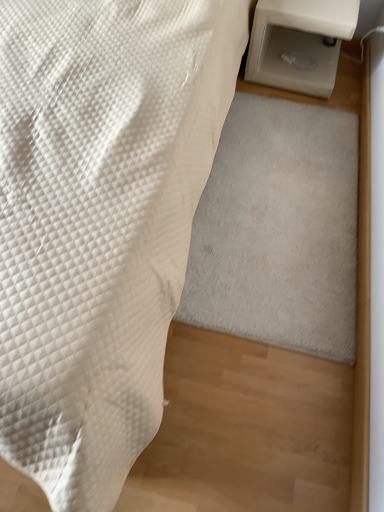
The image size is (384, 512). Find the location of `free point below white soft rug at lower right (from a real-world perspective)`. free point below white soft rug at lower right (from a real-world perspective) is located at coordinates (273, 217).